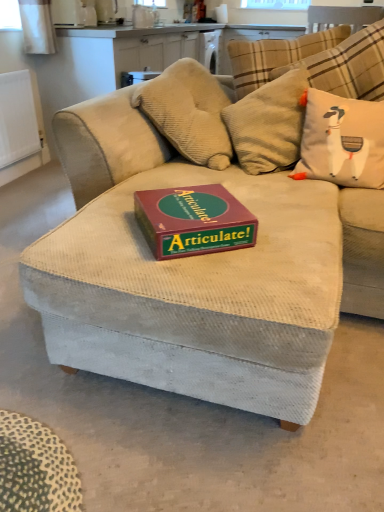
Question: Is white matte radiator at left in front of or behind maroon cardboard articulate! game box on the center in the image?

Choices:
 (A) front
 (B) behind

Answer: (B)

Question: From a real-world perspective, is white matte radiator at left positioned above or below maroon cardboard articulate! game box on the center?

Choices:
 (A) above
 (B) below

Answer: (B)

Question: Which of these objects is positioned closest to the white fabric pillow with cartoon llama at upper right?

Choices:
 (A) maroon cardboard articulate! game box on the center
 (B) white matte radiator at left

Answer: (A)

Question: Which object is the farthest from the white fabric pillow with cartoon llama at upper right?

Choices:
 (A) maroon cardboard articulate! game box on the center
 (B) white matte radiator at left

Answer: (B)